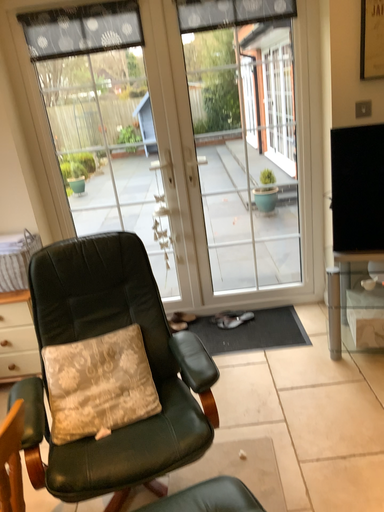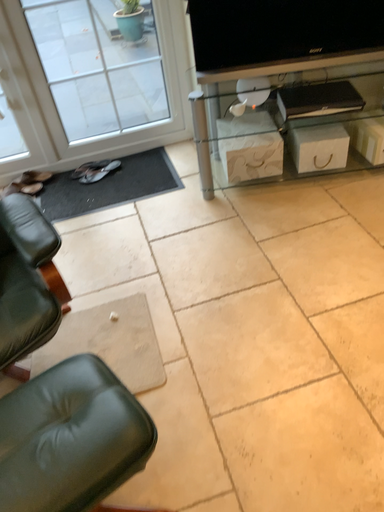
Question: How did the camera likely rotate when shooting the video?

Choices:
 (A) rotated right
 (B) rotated left

Answer: (A)